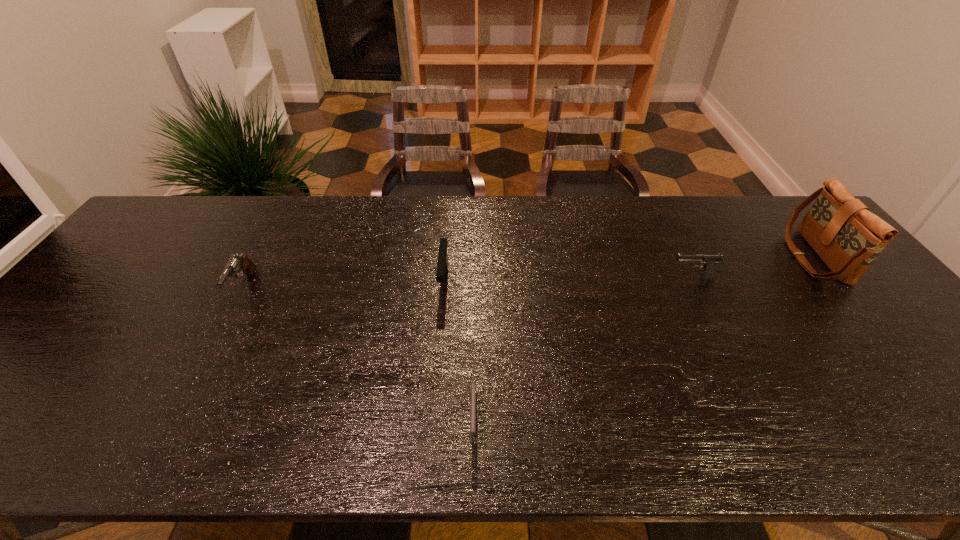
What are the coordinates of `the rightmost object` in the screenshot? It's located at (843, 232).

This screenshot has height=540, width=960. What are the coordinates of `the tallest object` in the screenshot? It's located at (843, 232).

Where is `the second pistol from left to right`? the second pistol from left to right is located at coordinates (442, 265).

You are a GUI agent. You are given a task and a screenshot of the screen. Output one action in this format:
    pyautogui.click(x=<x>, y=<y>)
    Task: Click on the leftmost pistol
    The image size is (960, 540).
    Given the screenshot: What is the action you would take?
    pyautogui.click(x=236, y=263)

Image resolution: width=960 pixels, height=540 pixels. What are the coordinates of `the rightmost pistol` in the screenshot? It's located at (710, 260).

Find the location of `the shortest pistol`. the shortest pistol is located at coordinates (473, 397).

Image resolution: width=960 pixels, height=540 pixels. What are the coordinates of `the third object from left to right` in the screenshot? It's located at (473, 397).

In order to click on vacant space located on the front-facing side of the shoulder bag in this screenshot , I will do `click(740, 257)`.

Locate an element on the screen. The width and height of the screenshot is (960, 540). vacant space located 0.330m on the front-facing side of the shoulder bag is located at coordinates (684, 257).

Locate an element on the screen. The image size is (960, 540). free space located on the front-facing side of the shoulder bag is located at coordinates (666, 257).